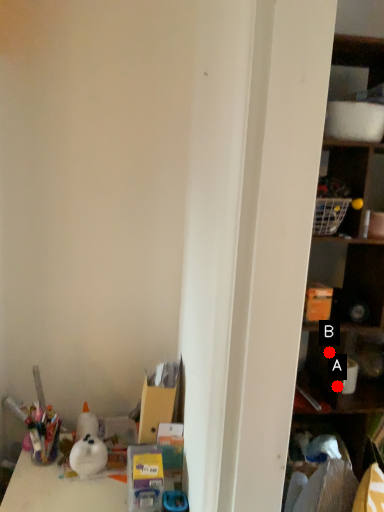
Question: Two points are circled on the image, labeled by A and B beside each circle. Which of the following is the closest to the observer?

Choices:
 (A) A is closer
 (B) B is closer

Answer: (A)